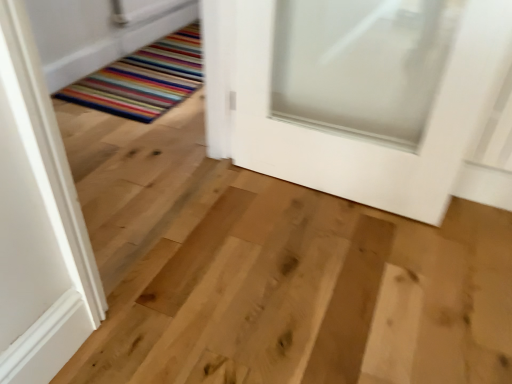
Question: Should I look upward or downward to see multicolored striped rug at lower left?

Choices:
 (A) down
 (B) up

Answer: (B)

Question: From a real-world perspective, is white matte door at center physically below multicolored striped rug at lower left?

Choices:
 (A) yes
 (B) no

Answer: (B)

Question: Does white matte door at center turn towards multicolored striped rug at lower left?

Choices:
 (A) yes
 (B) no

Answer: (B)

Question: Does white matte door at center have a smaller size compared to multicolored striped rug at lower left?

Choices:
 (A) no
 (B) yes

Answer: (A)

Question: Considering the relative sizes of white matte door at center and multicolored striped rug at lower left in the image provided, is white matte door at center taller than multicolored striped rug at lower left?

Choices:
 (A) no
 (B) yes

Answer: (B)

Question: Is white matte door at center facing away from multicolored striped rug at lower left?

Choices:
 (A) no
 (B) yes

Answer: (A)

Question: From a real-world perspective, is white matte door at center positioned over multicolored striped rug at lower left based on gravity?

Choices:
 (A) yes
 (B) no

Answer: (A)

Question: Does multicolored striped rug at lower left have a smaller size compared to white matte door at center?

Choices:
 (A) yes
 (B) no

Answer: (A)

Question: From the image's perspective, is multicolored striped rug at lower left located above white matte door at center?

Choices:
 (A) no
 (B) yes

Answer: (B)

Question: Can you confirm if multicolored striped rug at lower left is positioned to the right of white matte door at center?

Choices:
 (A) no
 (B) yes

Answer: (A)

Question: From the image's perspective, does multicolored striped rug at lower left appear lower than white matte door at center?

Choices:
 (A) yes
 (B) no

Answer: (B)

Question: Would you say multicolored striped rug at lower left is a long distance from white matte door at center?

Choices:
 (A) yes
 (B) no

Answer: (A)

Question: Is the surface of multicolored striped rug at lower left in direct contact with white matte door at center?

Choices:
 (A) no
 (B) yes

Answer: (A)

Question: Considering the relative positions of multicolored striped rug at lower left and white matte door at center in the image provided, is multicolored striped rug at lower left to the left or to the right of white matte door at center?

Choices:
 (A) left
 (B) right

Answer: (A)